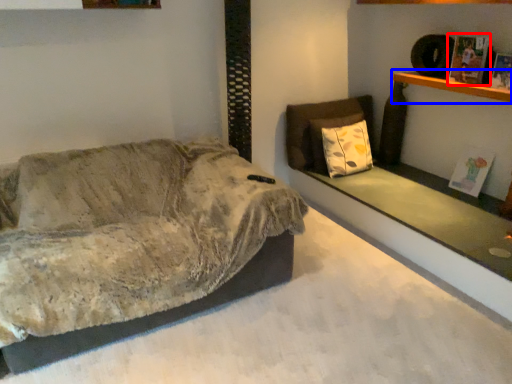
Question: Among these objects, which one is farthest to the camera, magazine (highlighted by a red box) or shelf (highlighted by a blue box)?

Choices:
 (A) magazine
 (B) shelf

Answer: (A)